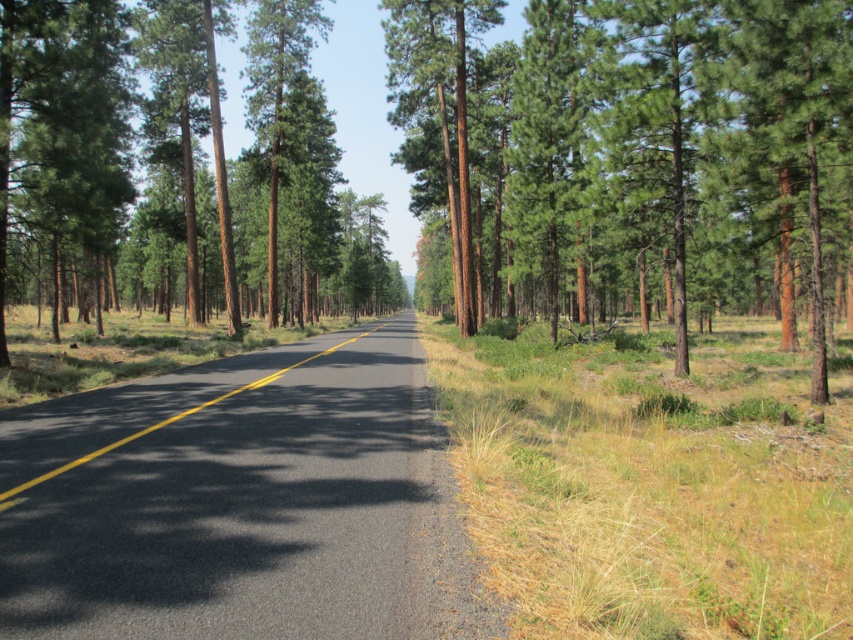
Is point (805, 109) closer to viewer compared to point (91, 456)?

No, it is behind (91, 456).

Which is behind, point (699, 65) or point (113, 444)?

The point (699, 65) is more distant.

What do you see at coordinates (637, 148) in the screenshot? The height and width of the screenshot is (640, 853). I see `green rough bark tree at center` at bounding box center [637, 148].

I want to click on green rough bark tree at center, so click(637, 148).